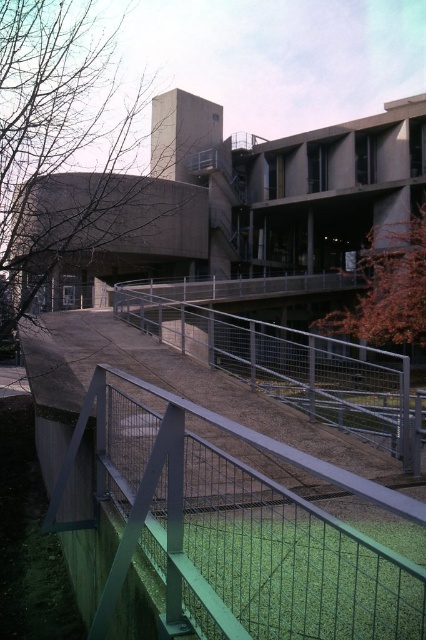
Question: Is brown leafy tree at upper left further to the viewer compared to brown leafy tree at center-right?

Choices:
 (A) no
 (B) yes

Answer: (A)

Question: Does green wire mesh fence at center have a greater width compared to brown leafy tree at upper left?

Choices:
 (A) no
 (B) yes

Answer: (A)

Question: Can you confirm if metal mesh fence at center is positioned above brown leafy tree at center-right?

Choices:
 (A) yes
 (B) no

Answer: (B)

Question: Which point is farther from the camera taking this photo?

Choices:
 (A) (126, 296)
 (B) (28, 308)
 (C) (408, 342)

Answer: (C)

Question: Which point is closer to the camera?

Choices:
 (A) brown leafy tree at center-right
 (B) green wire mesh fence at center
 (C) brown leafy tree at upper left

Answer: (B)

Question: Which object is farther from the camera taking this photo?

Choices:
 (A) brown leafy tree at center-right
 (B) metal mesh fence at center

Answer: (A)